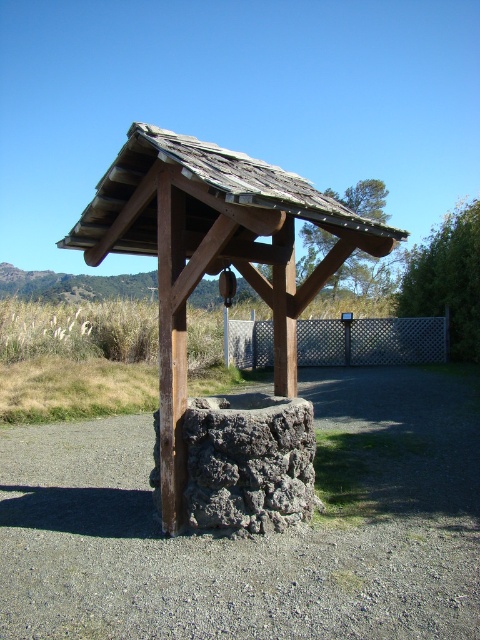
How distant is rustic wood gazebo at center from weathered wood roof at center?

rustic wood gazebo at center is 35.94 inches away from weathered wood roof at center.

Image resolution: width=480 pixels, height=640 pixels. I want to click on rustic wood gazebo at center, so click(226, 298).